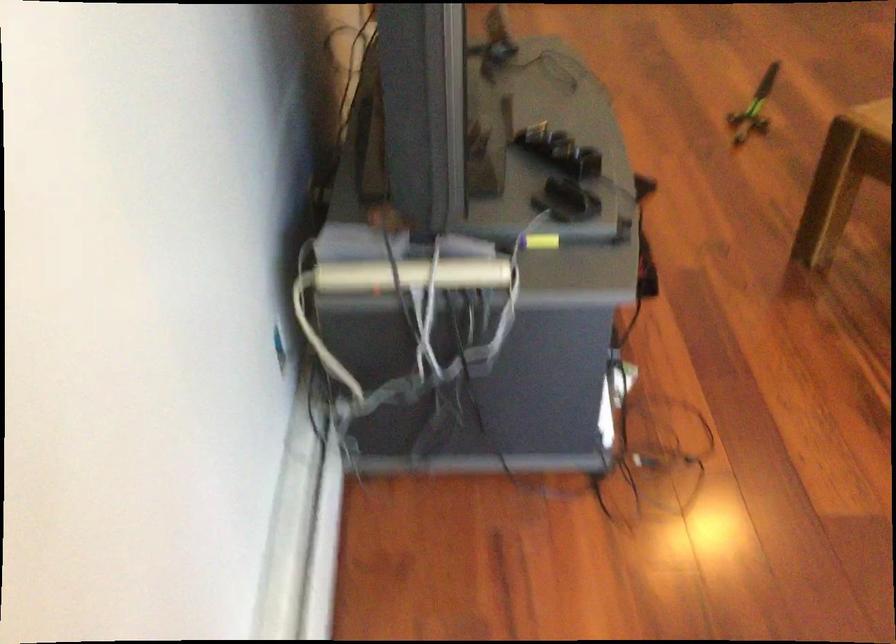
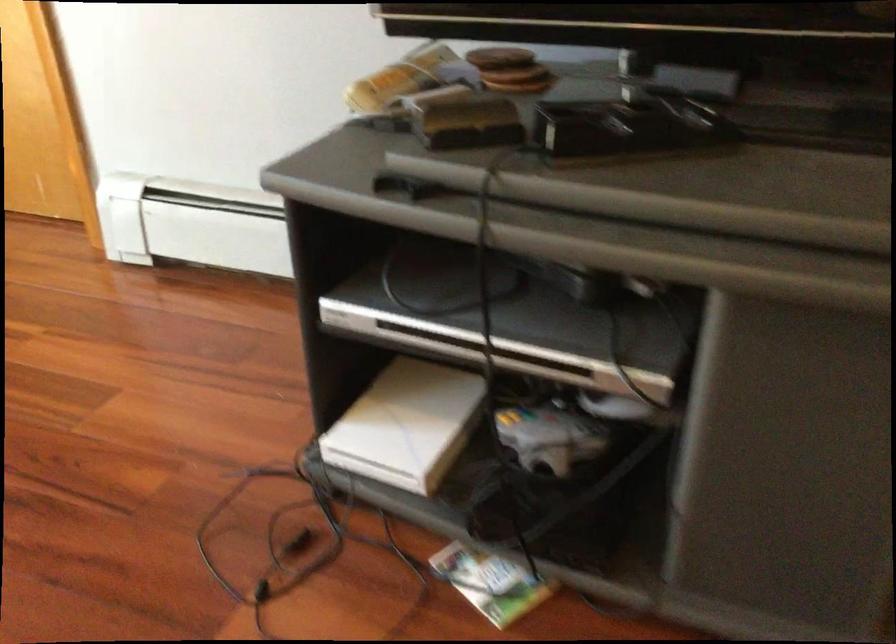
Locate, in the second image, the point that corresponds to (x=411, y=205) in the first image.

(500, 58)